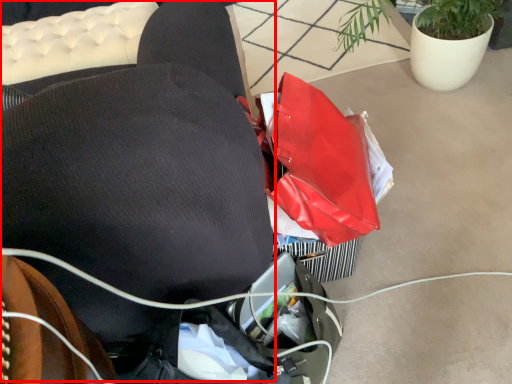
Question: From the image's perspective, where is bean bag chair (annotated by the red box) located relative to houseplant?

Choices:
 (A) below
 (B) above

Answer: (A)